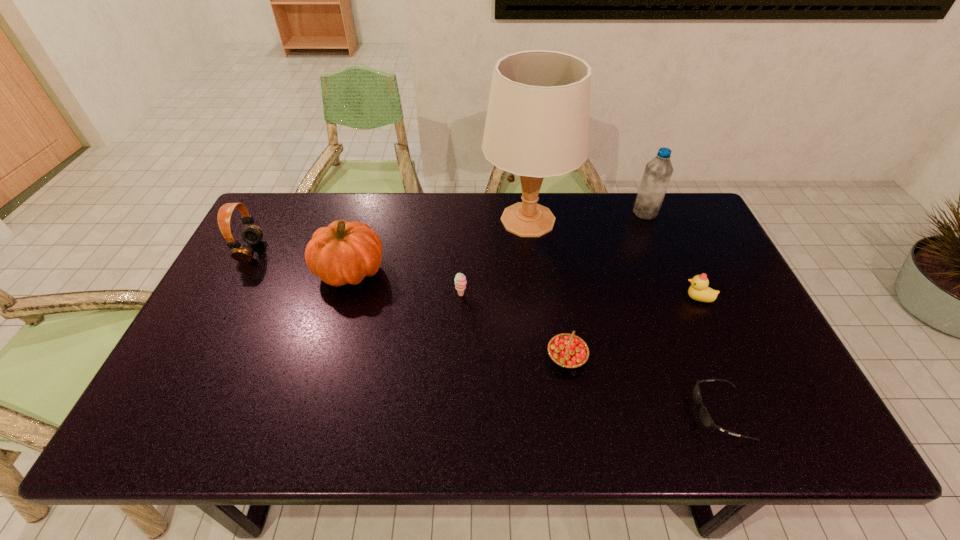
Where is `vacant space located 0.210m on the front-facing side of the nearest object`? This screenshot has width=960, height=540. vacant space located 0.210m on the front-facing side of the nearest object is located at coordinates (601, 413).

Identify the location of table lamp at the far edge. (537, 125).

Locate an element on the screen. The width and height of the screenshot is (960, 540). water bottle that is at the far edge is located at coordinates (658, 171).

This screenshot has width=960, height=540. In order to click on object that is at the near edge in this screenshot , I will do `click(705, 417)`.

I want to click on object that is at the left edge, so click(x=252, y=234).

I want to click on water bottle that is at the right edge, so coord(658,171).

Identify the location of duckling at the right edge. The image size is (960, 540). (699, 290).

Where is `sunglasses present at the right edge`? sunglasses present at the right edge is located at coordinates (705, 417).

Find the location of a particular element. This screenshot has width=960, height=540. object located at the far right corner is located at coordinates (658, 171).

Find the location of a particular element. object located at the near right corner is located at coordinates (705, 417).